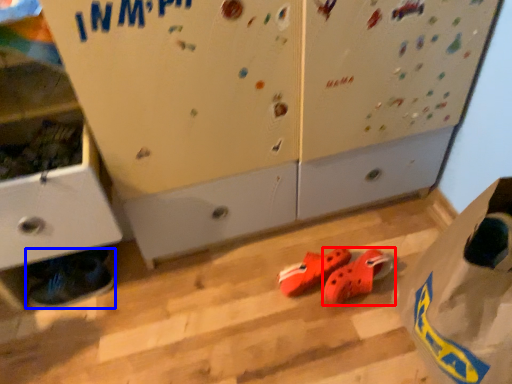
Question: Which object is closer to the camera taking this photo, footwear (highlighted by a red box) or footwear (highlighted by a blue box)?

Choices:
 (A) footwear
 (B) footwear

Answer: (A)